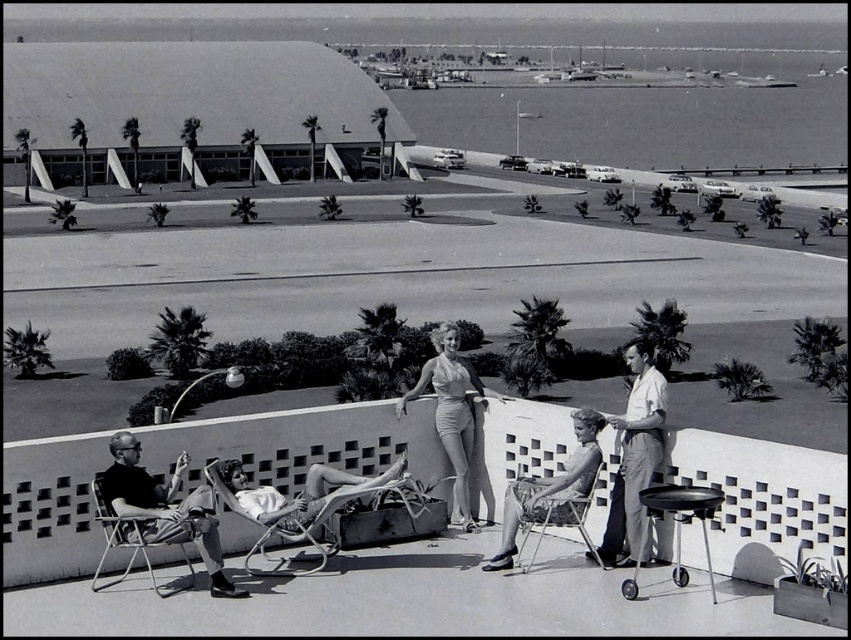
Question: Considering the real-world distances, which object is farthest from the matte white swimsuit at center?

Choices:
 (A) light gray fabric chair at lower right
 (B) metallic silver chair at lower right
 (C) dark gray fabric chair at lower left

Answer: (C)

Question: Does light gray fabric chair at lower right lie behind matte white swimsuit at center?

Choices:
 (A) no
 (B) yes

Answer: (A)

Question: Which of the following is the closest to the observer?

Choices:
 (A) (648, 470)
 (B) (461, 497)

Answer: (A)

Question: In this image, where is dark gray fabric chair at lower left located relative to metallic silver chair at lower right?

Choices:
 (A) above
 (B) below

Answer: (A)

Question: Which of the following is the farthest from the observer?

Choices:
 (A) matte white swimsuit at center
 (B) metallic silver chair at lower right

Answer: (A)

Question: Can you confirm if light gray fabric chair at lower right is positioned below metallic silver chair at lower right?

Choices:
 (A) yes
 (B) no

Answer: (B)